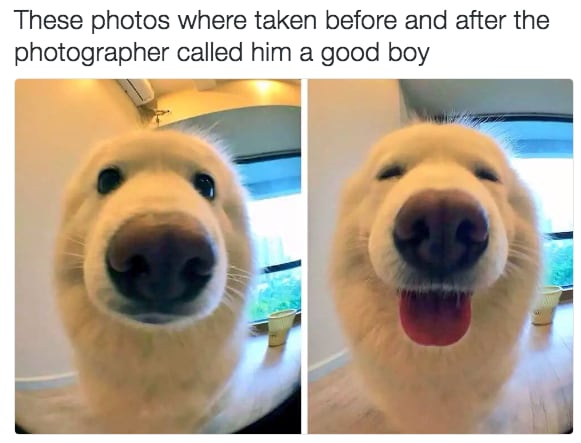
Identify the location of window. click(x=276, y=222), click(x=559, y=203).